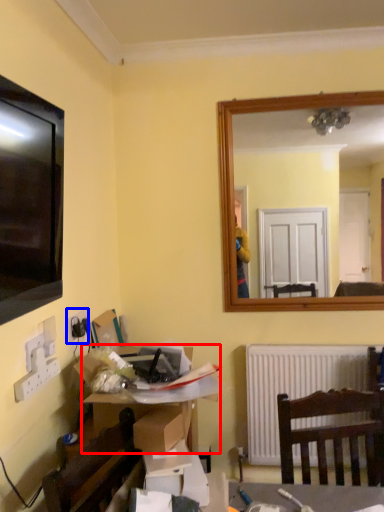
Question: Which object appears closest to the camera in this image, desk (highlighted by a red box) or electric outlet (highlighted by a blue box)?

Choices:
 (A) desk
 (B) electric outlet

Answer: (A)